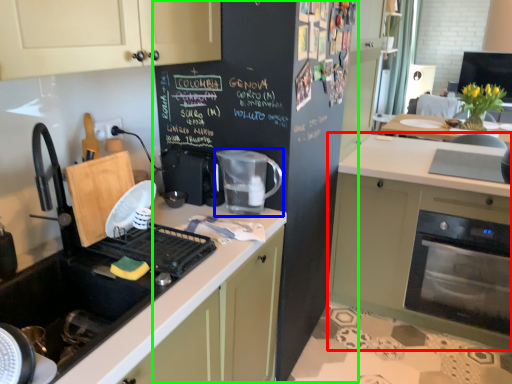
Question: Based on their relative distances, which object is nearer to cabinetry (highlighted by a red box)? Choose from kitchen appliance (highlighted by a blue box) and bulletin board (highlighted by a green box).

Choices:
 (A) kitchen appliance
 (B) bulletin board

Answer: (B)